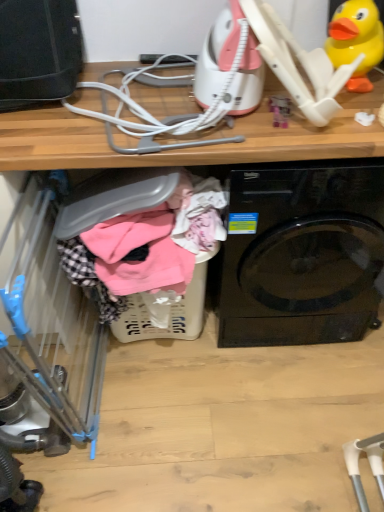
Question: Is plastic laundry basket at lower center wider or thinner than black glossy washing machine at center?

Choices:
 (A) thin
 (B) wide

Answer: (A)

Question: Considering the positions of plastic laundry basket at lower center and black glossy washing machine at center in the image, is plastic laundry basket at lower center bigger or smaller than black glossy washing machine at center?

Choices:
 (A) big
 (B) small

Answer: (B)

Question: Which object is positioned closest to the yellow rubber duck at upper right?

Choices:
 (A) blue plastic baby carriage at left
 (B) black glossy washing machine at center
 (C) plastic laundry basket at lower center

Answer: (B)

Question: Which object is the closest to the plastic laundry basket at lower center?

Choices:
 (A) black glossy washing machine at center
 (B) yellow rubber duck at upper right
 (C) blue plastic baby carriage at left

Answer: (C)